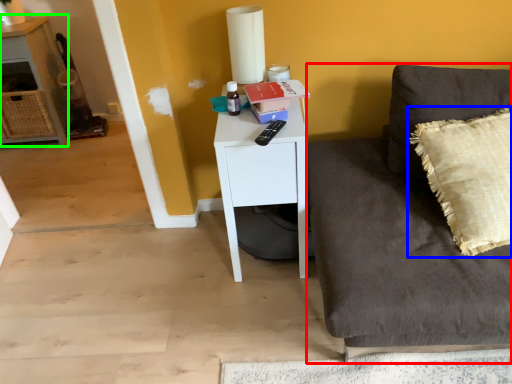
Question: Based on their relative distances, which object is nearer to studio couch (highlighted by a red box)? Choose from pillow (highlighted by a blue box) and cabinetry (highlighted by a green box).

Choices:
 (A) pillow
 (B) cabinetry

Answer: (A)